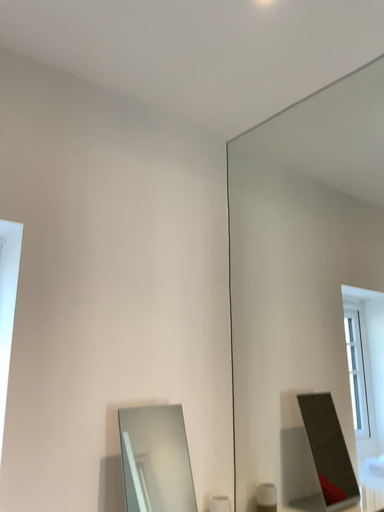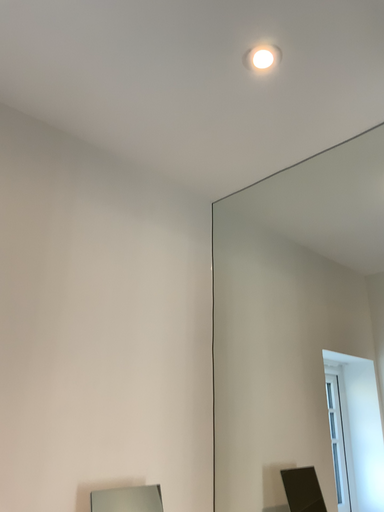
Question: How did the camera likely rotate when shooting the video?

Choices:
 (A) rotated downward
 (B) rotated upward

Answer: (B)